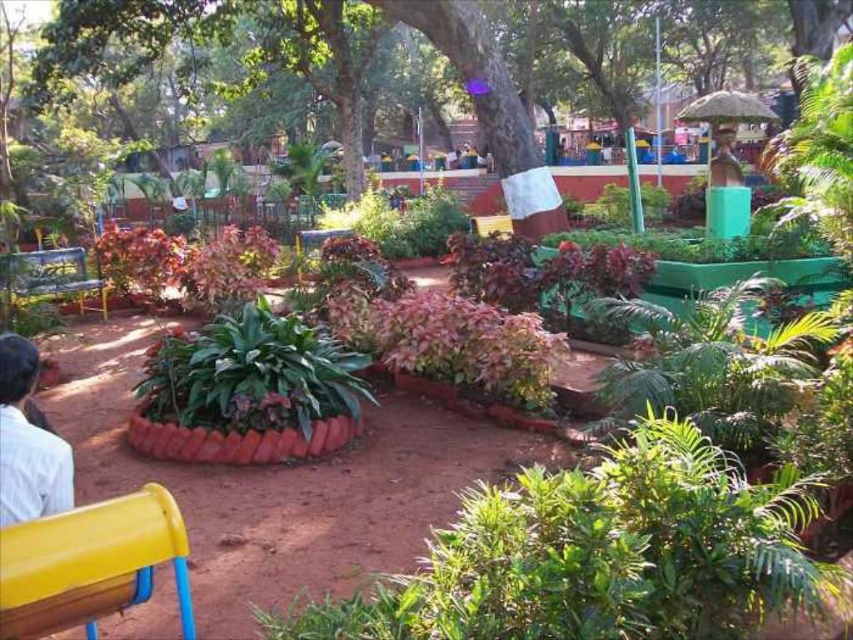
Is point (384, 38) farther from viewer compared to point (41, 250)?

That is True.

Consider the image. Who is lower down, green textured tree at center or metallic green bench at left?

metallic green bench at left is below.

In order to click on green textured tree at center in this screenshot , I will do `click(428, 64)`.

Image resolution: width=853 pixels, height=640 pixels. What are the coordinates of `green textured tree at center` in the screenshot? It's located at (428, 64).

From the picture: Which is below, green textured tree at center or white cloth at lower left?

Positioned lower is white cloth at lower left.

Is green textured tree at center bigger than white cloth at lower left?

Indeed, green textured tree at center has a larger size compared to white cloth at lower left.

Does point (425, 29) lie in front of point (4, 406)?

No, (425, 29) is further to viewer.

Identify the location of green textured tree at center. point(428,64).

Is yellow plastic bench at lower left wider than metallic green bench at left?

Incorrect, yellow plastic bench at lower left's width does not surpass metallic green bench at left's.

Between point (10, 604) and point (103, 308), which one is positioned in front?

Point (10, 604)

Does point (155, 500) come in front of point (53, 276)?

Yes, it is in front of point (53, 276).

Where is `yellow plastic bench at lower left`? Image resolution: width=853 pixels, height=640 pixels. yellow plastic bench at lower left is located at coordinates (91, 563).